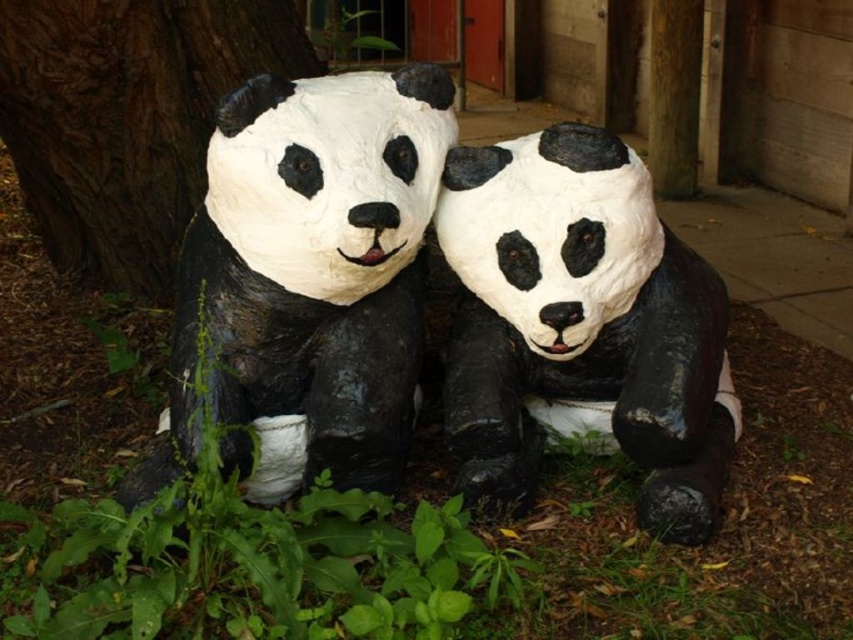
Question: Based on their relative distances, which object is farther from the brown rough bark at left?

Choices:
 (A) black matte/paper mache panda at center
 (B) matte papier-mâché panda at center

Answer: (A)

Question: Which of these objects is positioned farthest from the black matte/paper mache panda at center?

Choices:
 (A) matte papier-mâché panda at center
 (B) brown rough bark at left

Answer: (B)

Question: Is matte papier-mâché panda at center smaller than brown rough bark at left?

Choices:
 (A) yes
 (B) no

Answer: (A)

Question: From the image, what is the correct spatial relationship of matte papier-mâché panda at center in relation to brown rough bark at left?

Choices:
 (A) above
 (B) below

Answer: (B)

Question: Is matte papier-mâché panda at center further to camera compared to black matte/paper mache panda at center?

Choices:
 (A) no
 (B) yes

Answer: (A)

Question: Which object appears farthest from the camera in this image?

Choices:
 (A) brown rough bark at left
 (B) matte papier-mâché panda at center
 (C) black matte/paper mache panda at center

Answer: (A)